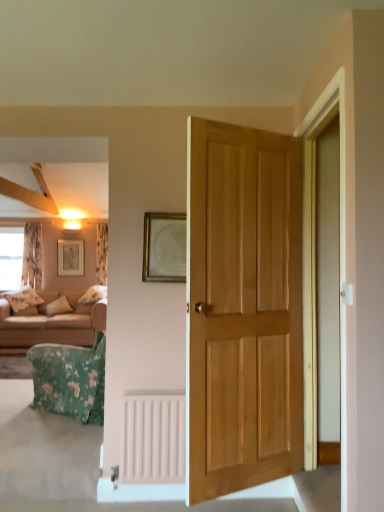
The image size is (384, 512). Describe the element at coordinates (102, 253) in the screenshot. I see `floral fabric curtain at left, the second curtain when ordered from left to right` at that location.

Where is `matte gold picture frame at upper left, the second picture frame from the front`? matte gold picture frame at upper left, the second picture frame from the front is located at coordinates (70, 257).

From the picture: Measure the distance between clear glass window at left and camera.

clear glass window at left and camera are 22.41 feet apart.

The image size is (384, 512). What are the coordinates of `gold metallic picture frame at center, which ranks as the second picture frame in back-to-front order` in the screenshot? It's located at (164, 247).

Considering the positions of objects floral fabric curtain at left, placed as the first curtain when sorted from left to right, and beige fabric couch at left in the image provided, who is more to the left, floral fabric curtain at left, placed as the first curtain when sorted from left to right, or beige fabric couch at left?

Positioned to the left is floral fabric curtain at left, placed as the first curtain when sorted from left to right.

From the image's perspective, which is above, floral fabric curtain at left, which is the 2th curtain from right to left, or beige fabric couch at left?

floral fabric curtain at left, which is the 2th curtain from right to left, is shown above in the image.

Who is taller, floral fabric curtain at left, placed as the first curtain when sorted from left to right, or beige fabric couch at left?

floral fabric curtain at left, placed as the first curtain when sorted from left to right, is taller.

Is floral fabric curtain at left, placed as the first curtain when sorted from left to right, thinner than beige fabric couch at left?

Yes.

Would you say matte gold picture frame at upper left, the second picture frame when ordered from right to left, is inside or outside light brown wooden door at center?

matte gold picture frame at upper left, the second picture frame when ordered from right to left, is spatially situated outside light brown wooden door at center.

In the image, there is a matte gold picture frame at upper left, the second picture frame when ordered from right to left. At what (x,y) coordinates should I click in order to perform the action: click on door below it (from a real-world perspective). Please return your answer as a coordinate pair (x, y). This screenshot has height=512, width=384. Looking at the image, I should click on (243, 308).

Is light brown wooden door at center at the back of matte gold picture frame at upper left, which ranks as the 1th picture frame in back-to-front order?

matte gold picture frame at upper left, which ranks as the 1th picture frame in back-to-front order, is not turned away from light brown wooden door at center.

Does clear glass window at left have a larger size compared to floral fabric curtain at left, the second curtain when ordered from left to right?

No.

From a real-world perspective, who is located lower, clear glass window at left or floral fabric curtain at left, the second curtain when ordered from left to right?

clear glass window at left, from a real-world perspective.

Is point (15, 271) farther from viewer compared to point (99, 260)?

No, it is not.

Is clear glass window at left aimed at floral fabric curtain at left, which is the 1th curtain from right to left?

No.

The image size is (384, 512). In order to click on curtain lying on the left of beige fabric couch at left in this screenshot , I will do `click(32, 255)`.

Is beige fabric couch at left not near floral fabric curtain at left, which is the 2th curtain from right to left?

beige fabric couch at left is near floral fabric curtain at left, which is the 2th curtain from right to left, not far away.

Is beige fabric couch at left looking in the opposite direction of floral fabric curtain at left, which is the 2th curtain from right to left?

No, beige fabric couch at left's orientation is not away from floral fabric curtain at left, which is the 2th curtain from right to left.

Considering the relative sizes of gold metallic picture frame at center, the 2th picture frame when ordered from left to right, and floral fabric curtain at left, which is the 2th curtain from right to left, in the image provided, is gold metallic picture frame at center, the 2th picture frame when ordered from left to right, wider than floral fabric curtain at left, which is the 2th curtain from right to left,?

No.

Is the position of gold metallic picture frame at center, which ranks as the second picture frame in back-to-front order, less distant than that of floral fabric curtain at left, placed as the first curtain when sorted from left to right?

Yes, gold metallic picture frame at center, which ranks as the second picture frame in back-to-front order, is in front of floral fabric curtain at left, placed as the first curtain when sorted from left to right.

From the image's perspective, is gold metallic picture frame at center, which is the first picture frame from right to left, above or below floral fabric curtain at left, placed as the first curtain when sorted from left to right?

gold metallic picture frame at center, which is the first picture frame from right to left, is situated higher than floral fabric curtain at left, placed as the first curtain when sorted from left to right, in the image.

Would you say gold metallic picture frame at center, which is the first picture frame from right to left, is to the left or to the right of floral fabric curtain at left, the second curtain when ordered from left to right, in the picture?

Based on their positions, gold metallic picture frame at center, which is the first picture frame from right to left, is located to the right of floral fabric curtain at left, the second curtain when ordered from left to right.

Looking at their sizes, would you say gold metallic picture frame at center, the 2th picture frame when ordered from left to right, is wider or thinner than floral fabric curtain at left, which is the 1th curtain from right to left?

gold metallic picture frame at center, the 2th picture frame when ordered from left to right, is thinner than floral fabric curtain at left, which is the 1th curtain from right to left.

Can you confirm if gold metallic picture frame at center, which is counted as the first picture frame, starting from the front, is smaller than floral fabric curtain at left, which is the 1th curtain from right to left?

Correct, gold metallic picture frame at center, which is counted as the first picture frame, starting from the front, occupies less space than floral fabric curtain at left, which is the 1th curtain from right to left.

Is gold metallic picture frame at center, which is counted as the first picture frame, starting from the front, positioned behind floral fabric curtain at left, the second curtain when ordered from left to right?

No, it is not.

Is gold metallic picture frame at center, the 2th picture frame when ordered from left to right, spatially inside clear glass window at left, or outside of it?

gold metallic picture frame at center, the 2th picture frame when ordered from left to right, cannot be found inside clear glass window at left.

From a real-world perspective, which is physically below, gold metallic picture frame at center, which is the first picture frame from right to left, or clear glass window at left?

gold metallic picture frame at center, which is the first picture frame from right to left, is physically lower.

Is gold metallic picture frame at center, which ranks as the second picture frame in back-to-front order, taller than clear glass window at left?

No, gold metallic picture frame at center, which ranks as the second picture frame in back-to-front order, is not taller than clear glass window at left.

Find the location of a particular element. Image resolution: width=384 pixels, height=512 pixels. picture frame below the clear glass window at left (from a real-world perspective) is located at coordinates (164, 247).

This screenshot has width=384, height=512. What are the coordinates of `studio couch on the right side of floral fabric curtain at left, placed as the first curtain when sorted from left to right` in the screenshot? It's located at (51, 323).

Image resolution: width=384 pixels, height=512 pixels. There is a light brown wooden door at center. What are the coordinates of `the 2nd picture frame above it (from a real-world perspective)` in the screenshot? It's located at (70, 257).

Based on their spatial positions, is floral fabric curtain at left, which is the 1th curtain from right to left, or clear glass window at left further from light brown wooden door at center?

Among the two, floral fabric curtain at left, which is the 1th curtain from right to left, is located further to light brown wooden door at center.

Looking at the image, which one is located closer to gold metallic picture frame at center, which is counted as the first picture frame, starting from the front, floral fabric curtain at left, the second curtain when ordered from left to right, or beige fabric couch at left?

beige fabric couch at left lies closer to gold metallic picture frame at center, which is counted as the first picture frame, starting from the front, than the other object.

Estimate the real-world distances between objects in this image. Which object is further from floral fabric curtain at left, the second curtain when ordered from left to right, floral fabric curtain at left, which is the 2th curtain from right to left, or matte gold picture frame at upper left, the second picture frame from the front?

floral fabric curtain at left, which is the 2th curtain from right to left, is further to floral fabric curtain at left, the second curtain when ordered from left to right.

Based on the photo, from the image, which object appears to be nearer to light brown wooden door at center, floral fabric curtain at left, which is the 2th curtain from right to left, or clear glass window at left?

The object closer to light brown wooden door at center is clear glass window at left.

From the image, which object appears to be farther from matte gold picture frame at upper left, the second picture frame from the front, light brown wooden door at center or beige fabric couch at left?

light brown wooden door at center is positioned further to the anchor matte gold picture frame at upper left, the second picture frame from the front.

Which object lies further to the anchor point light brown wooden door at center, matte gold picture frame at upper left, which is counted as the first picture frame, starting from the left, or clear glass window at left?

matte gold picture frame at upper left, which is counted as the first picture frame, starting from the left.

When comparing their distances from gold metallic picture frame at center, which is counted as the first picture frame, starting from the front, does clear glass window at left or floral fabric curtain at left, the second curtain when ordered from left to right, seem further?

floral fabric curtain at left, the second curtain when ordered from left to right, is further to gold metallic picture frame at center, which is counted as the first picture frame, starting from the front.

Based on their spatial positions, is light brown wooden door at center or gold metallic picture frame at center, which is the first picture frame from right to left, closer to floral fabric curtain at left, placed as the first curtain when sorted from left to right?

gold metallic picture frame at center, which is the first picture frame from right to left, lies closer to floral fabric curtain at left, placed as the first curtain when sorted from left to right, than the other object.

I want to click on studio couch between clear glass window at left and floral fabric curtain at left, the second curtain when ordered from left to right, in the horizontal direction, so click(51, 323).

This screenshot has width=384, height=512. Find the location of `picture frame positioned between light brown wooden door at center and floral fabric curtain at left, the second curtain when ordered from left to right, from near to far`. picture frame positioned between light brown wooden door at center and floral fabric curtain at left, the second curtain when ordered from left to right, from near to far is located at coordinates (164, 247).

The image size is (384, 512). What are the coordinates of `studio couch located between light brown wooden door at center and floral fabric curtain at left, which is the 1th curtain from right to left, in the depth direction` in the screenshot? It's located at (51, 323).

Locate an element on the screen. This screenshot has width=384, height=512. picture frame between light brown wooden door at center and matte gold picture frame at upper left, the second picture frame when ordered from right to left, from front to back is located at coordinates (164, 247).